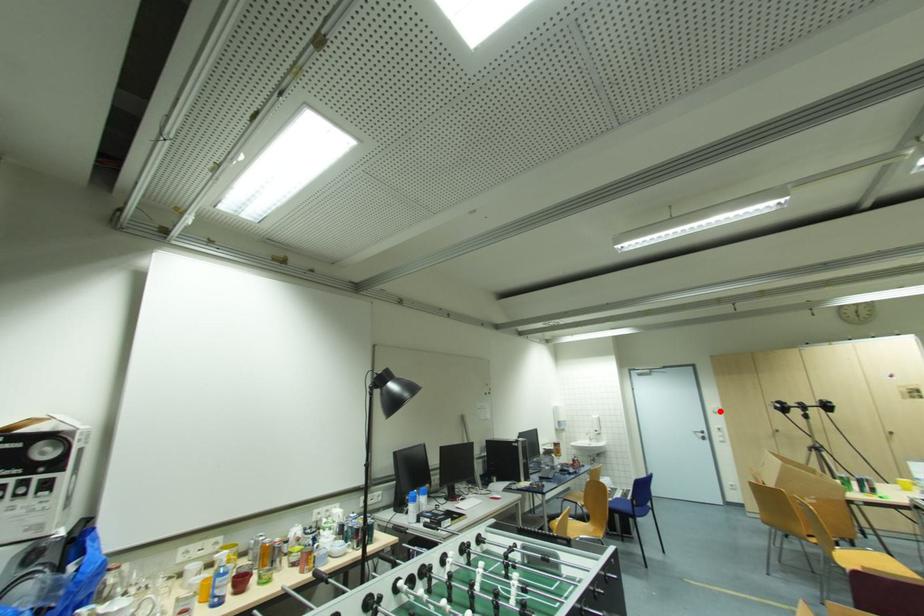
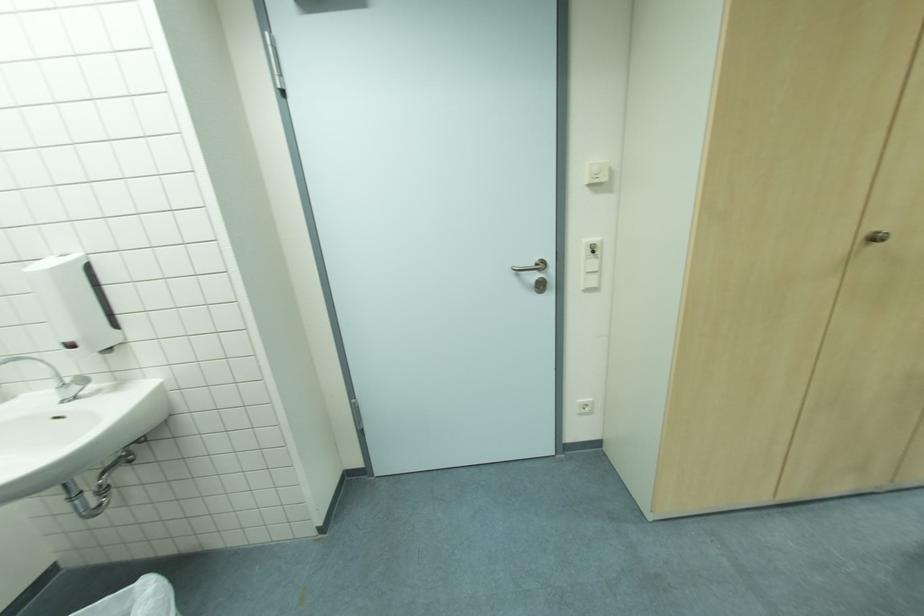
Question: I am providing you with two images of the same scene from different viewpoints. Given a red point in image1, look at the same physical point in image2. Is it:

Choices:
 (A) Closer to the viewpoint
 (B) Farther from the viewpoint

Answer: (A)